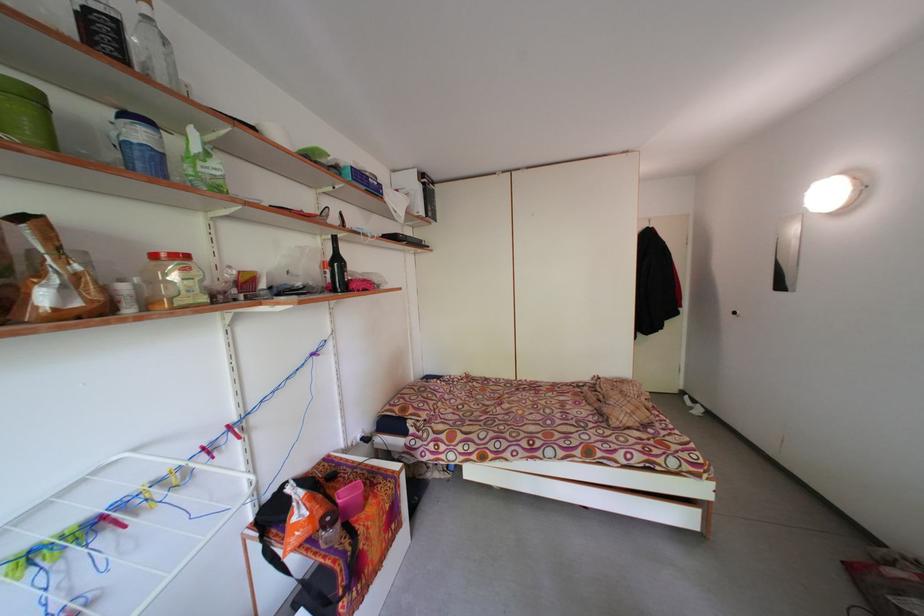
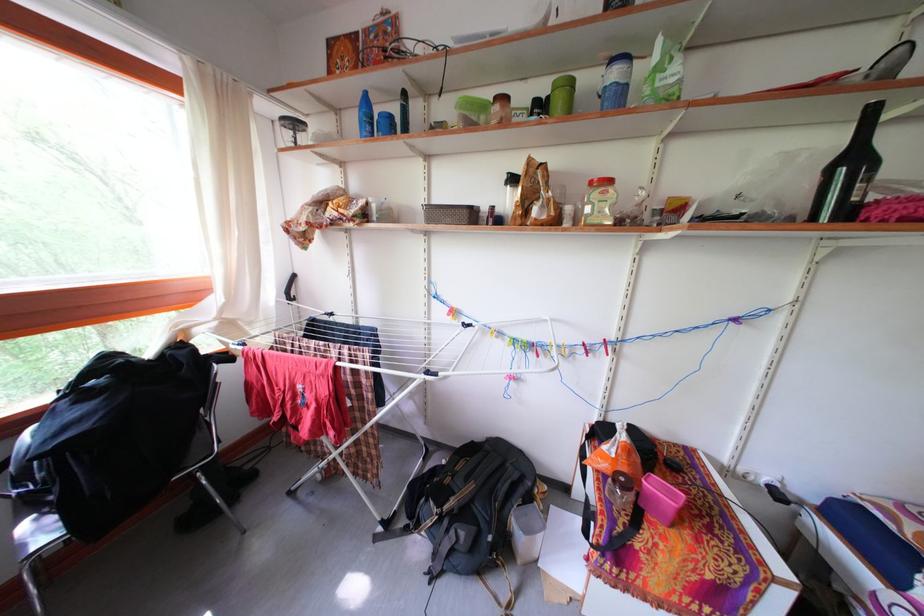
The point at (114, 543) is marked in the first image. Where is the corresponding point in the second image?

(540, 361)